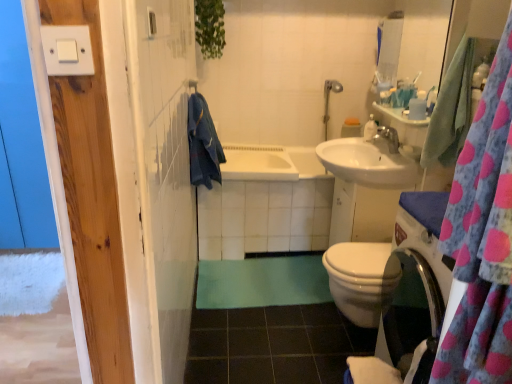
Question: Is white glossy sink at center right looking in the opposite direction of pink polka dot fabric at right?

Choices:
 (A) no
 (B) yes

Answer: (A)

Question: Is white glossy sink at center right shorter than pink polka dot fabric at right?

Choices:
 (A) yes
 (B) no

Answer: (A)

Question: Does white glossy sink at center right come in front of pink polka dot fabric at right?

Choices:
 (A) yes
 (B) no

Answer: (B)

Question: From a real-world perspective, is white glossy sink at center right over pink polka dot fabric at right?

Choices:
 (A) no
 (B) yes

Answer: (A)

Question: Does white glossy sink at center right lie behind pink polka dot fabric at right?

Choices:
 (A) no
 (B) yes

Answer: (B)

Question: Considering the positions of point (215, 165) and point (242, 180), is point (215, 165) closer or farther from the camera than point (242, 180)?

Choices:
 (A) closer
 (B) farther

Answer: (A)

Question: Is denim towel at center, acting as the 1th bath towel starting from the left, taller or shorter than white ceramic bathtub at center, which appears as the 2th bath when viewed from the top?

Choices:
 (A) tall
 (B) short

Answer: (B)

Question: From the image's perspective, relative to white ceramic bathtub at center, which ranks as the first bath in bottom-to-top order, is denim towel at center, the first bath towel viewed from the back, above or below?

Choices:
 (A) above
 (B) below

Answer: (A)

Question: Is denim towel at center, the first bath towel viewed from the back, situated inside white ceramic bathtub at center, which ranks as the first bath in bottom-to-top order, or outside?

Choices:
 (A) outside
 (B) inside

Answer: (A)

Question: Choose the correct answer: Is white plastic light switch at upper left inside glossy ceramic mirror at upper right or outside it?

Choices:
 (A) outside
 (B) inside

Answer: (A)

Question: From the image's perspective, is white plastic light switch at upper left positioned above or below glossy ceramic mirror at upper right?

Choices:
 (A) above
 (B) below

Answer: (B)

Question: Considering the positions of white plastic light switch at upper left and glossy ceramic mirror at upper right in the image, is white plastic light switch at upper left taller or shorter than glossy ceramic mirror at upper right?

Choices:
 (A) short
 (B) tall

Answer: (A)

Question: Is white plastic light switch at upper left in front of or behind glossy ceramic mirror at upper right in the image?

Choices:
 (A) behind
 (B) front

Answer: (B)

Question: Is silver metallic faucet at upper center taller or shorter than green rubber mat at lower center?

Choices:
 (A) short
 (B) tall

Answer: (B)

Question: Considering the positions of silver metallic faucet at upper center and green rubber mat at lower center in the image, is silver metallic faucet at upper center bigger or smaller than green rubber mat at lower center?

Choices:
 (A) big
 (B) small

Answer: (B)